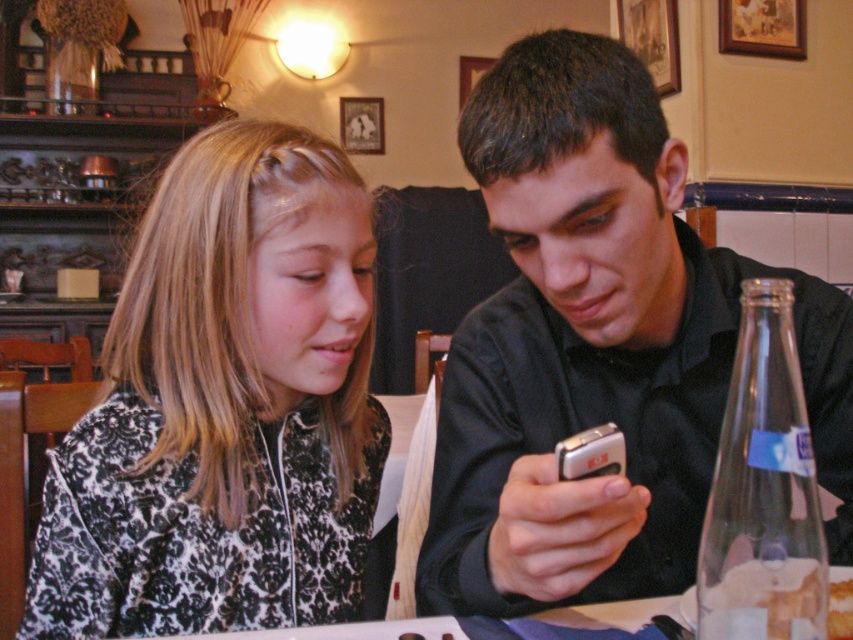
You are sitting at the table in the restaurant. You want to reach for an object that is closer to you. Which point should you reach towards, point (x=672, y=304) or point (x=793, y=636)?

You should reach towards point (x=672, y=304) because it is closer to you than point (x=793, y=636).

You are a waiter in a restaurant and need to place a 12 inch long dessert plate between the black damask jacket at left and the translucent glass bread at lower right. Will there be enough space for the dessert plate?

The distance between the black damask jacket at left and the translucent glass bread at lower right is 16.83 inches, so yes, the 12 inch dessert plate will fit comfortably between them with some space to spare.

You are a photographer setting up a shot of the scene described. You need to ensure that the black matte shirt at center and the black damask jacket at left are both visible in the frame. Based on their heights, which object should you position closer to the camera to avoid one blocking the other?

The black matte shirt at center is taller than the black damask jacket at left, so positioning the black damask jacket at left closer to the camera would help prevent the taller black matte shirt at center from blocking it.